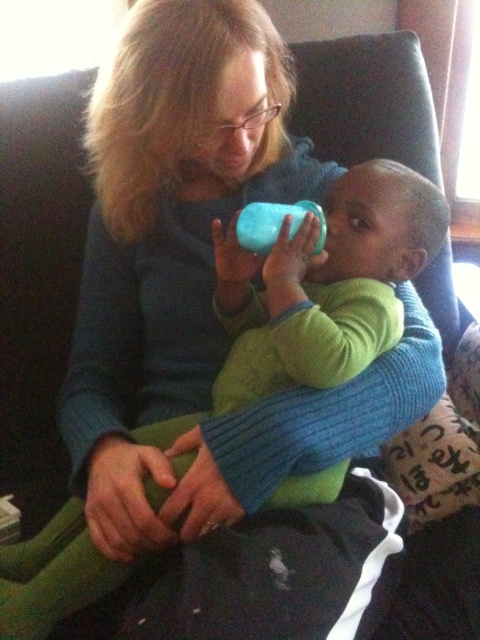
Question: Among these objects, which one is nearest to the camera?

Choices:
 (A) blue rubber sippy cup at center
 (B) green soft baby at center

Answer: (B)

Question: Does green soft baby at center appear on the right side of blue rubber sippy cup at center?

Choices:
 (A) no
 (B) yes

Answer: (A)

Question: Does green soft baby at center have a smaller size compared to blue rubber sippy cup at center?

Choices:
 (A) yes
 (B) no

Answer: (B)

Question: Is green soft baby at center to the left of blue rubber sippy cup at center from the viewer's perspective?

Choices:
 (A) yes
 (B) no

Answer: (A)

Question: Which point is farther to the camera?

Choices:
 (A) blue rubber sippy cup at center
 (B) green soft baby at center

Answer: (A)